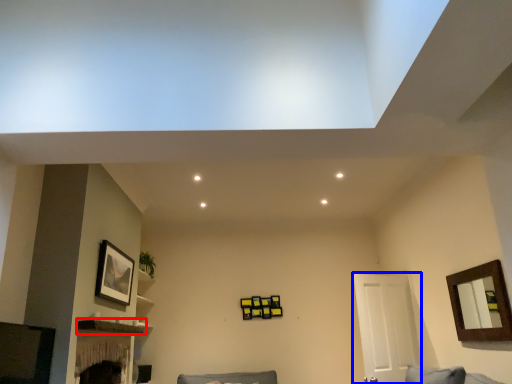
Question: Which of the following is the closest to the observer, shelf (highlighted by a red box) or door (highlighted by a blue box)?

Choices:
 (A) shelf
 (B) door

Answer: (A)